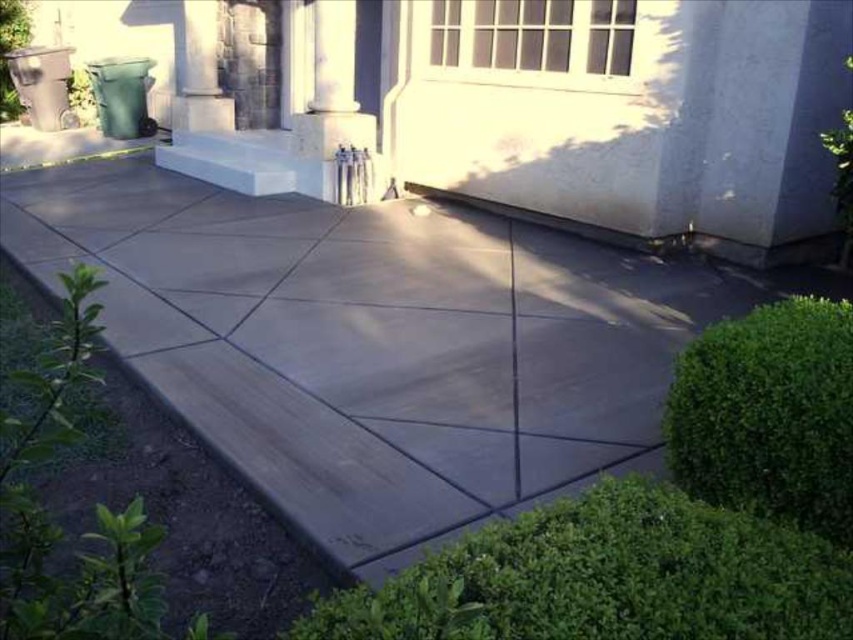
You are standing at the point with coordinates (608, 577) in the image. What object is located at that point?

The green leafy hedge at lower right is located at point (608, 577).

You are a landscape architect designing a garden path. You need to place a bench between the green leafy hedge at lower right and the white textured window at upper center. Which object should the bench be closer to to ensure it fits within the available space?

The bench should be closer to the green leafy hedge at lower right because its width is narrower than the white textured window at upper center, allowing more space near the hedge.